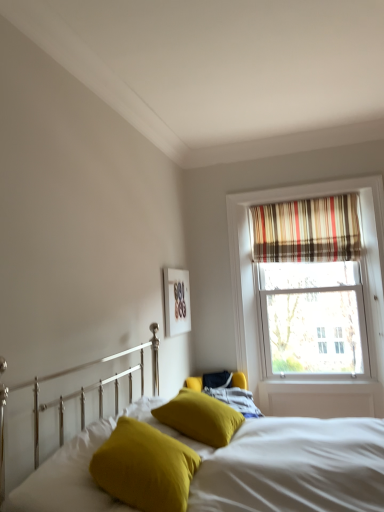
In order to click on velvety yellow pillow at lower left, which ranks as the 3th pillow in right-to-left order in this screenshot , I will do `click(68, 478)`.

What do you see at coordinates (286, 464) in the screenshot?
I see `velvet yellow pillows at center` at bounding box center [286, 464].

The image size is (384, 512). I want to click on velvet yellow pillows at center, so click(x=286, y=464).

What are the coordinates of `mustard yellow fabric pillow at lower center, which ranks as the second pillow in right-to-left order` in the screenshot? It's located at (145, 467).

How much space does mustard yellow fabric pillow at center, which is counted as the 1th pillow, starting from the right, occupy horizontally?

It is 19.24 inches.

Find the location of a particular element. This screenshot has height=512, width=384. striped fabric curtain at upper right is located at coordinates (307, 230).

Between velvety yellow pillow at lower left, which ranks as the 3th pillow in right-to-left order, and mustard yellow fabric pillow at lower center, which ranks as the second pillow in left-to-right order, which one appears on the left side from the viewer's perspective?

From the viewer's perspective, velvety yellow pillow at lower left, which ranks as the 3th pillow in right-to-left order, appears more on the left side.

Would you consider velvety yellow pillow at lower left, which is the 1th pillow from left to right, to be distant from mustard yellow fabric pillow at lower center, which ranks as the second pillow in right-to-left order?

They are positioned close to each other.

From a real-world perspective, which object rests below the other?

velvety yellow pillow at lower left, which is the 1th pillow from left to right, from a real-world perspective.

Considering the sizes of objects velvet yellow pillows at center and striped fabric curtain at upper right in the image provided, who is shorter, velvet yellow pillows at center or striped fabric curtain at upper right?

striped fabric curtain at upper right is shorter.

Is velvet yellow pillows at center not inside striped fabric curtain at upper right?

Yes, velvet yellow pillows at center is located beyond the bounds of striped fabric curtain at upper right.

From the image's perspective, which one is positioned lower, velvet yellow pillows at center or striped fabric curtain at upper right?

velvet yellow pillows at center.

Which is behind, matte white picture frame at upper center or striped fabric curtain at upper right?

Positioned behind is striped fabric curtain at upper right.

In the image, there is a matte white picture frame at upper center. At what (x,y) coordinates should I click in order to perform the action: click on curtain above it (from the image's perspective). Please return your answer as a coordinate pair (x, y). The width and height of the screenshot is (384, 512). Looking at the image, I should click on (307, 230).

Measure the distance from matte white picture frame at upper center to striped fabric curtain at upper right.

matte white picture frame at upper center is 4.15 feet away from striped fabric curtain at upper right.

What's the angular difference between matte white picture frame at upper center and striped fabric curtain at upper right's facing directions?

The angle between the facing direction of matte white picture frame at upper center and the facing direction of striped fabric curtain at upper right is 88.5 degrees.

Does mustard yellow fabric pillow at center, which is counted as the 1th pillow, starting from the right, have a lesser height compared to velvety yellow pillow at lower left, which is the 1th pillow from left to right?

In fact, mustard yellow fabric pillow at center, which is counted as the 1th pillow, starting from the right, may be taller than velvety yellow pillow at lower left, which is the 1th pillow from left to right.

Which is closer to the camera, (197, 406) or (36, 494)?

The point (36, 494) is closer to the camera.

You are a GUI agent. You are given a task and a screenshot of the screen. Output one action in this format:
    pyautogui.click(x=<x>, y=<y>)
    Task: Click on the pillow that is the 2nd object located in front of the mustard yellow fabric pillow at center, positioned as the 3th pillow in left-to-right order
    The height and width of the screenshot is (512, 384).
    Given the screenshot: What is the action you would take?
    pyautogui.click(x=68, y=478)

Is striped fabric curtain at upper right oriented away from velvet yellow pillows at center?

No, velvet yellow pillows at center is not at the back of striped fabric curtain at upper right.

Which is less distant, (x=262, y=211) or (x=347, y=421)?

Point (x=262, y=211) is farther from the camera than point (x=347, y=421).

Does striped fabric curtain at upper right contain velvet yellow pillows at center?

That's incorrect, velvet yellow pillows at center is not inside striped fabric curtain at upper right.

In terms of width, does striped fabric curtain at upper right look wider or thinner when compared to velvet yellow pillows at center?

In the image, striped fabric curtain at upper right appears to be more narrow than velvet yellow pillows at center.

Does point (186, 329) lie behind point (215, 426)?

Yes, it is.

Is matte white picture frame at upper center to the left or to the right of mustard yellow fabric pillow at center, which is counted as the 1th pillow, starting from the right, in the image?

matte white picture frame at upper center is to the left of mustard yellow fabric pillow at center, which is counted as the 1th pillow, starting from the right.

Locate an element on the screen. The image size is (384, 512). picture frame positioned vertically above the mustard yellow fabric pillow at center, positioned as the 3th pillow in left-to-right order (from a real-world perspective) is located at coordinates (176, 301).

Can you confirm if matte white picture frame at upper center is taller than mustard yellow fabric pillow at center, positioned as the 3th pillow in left-to-right order?

Correct, matte white picture frame at upper center is much taller as mustard yellow fabric pillow at center, positioned as the 3th pillow in left-to-right order.

Measure the distance from mustard yellow fabric pillow at lower center, which ranks as the second pillow in left-to-right order, to striped fabric curtain at upper right.

mustard yellow fabric pillow at lower center, which ranks as the second pillow in left-to-right order, is 2.84 meters away from striped fabric curtain at upper right.

Is mustard yellow fabric pillow at lower center, which ranks as the second pillow in left-to-right order, looking in the opposite direction of striped fabric curtain at upper right?

No, mustard yellow fabric pillow at lower center, which ranks as the second pillow in left-to-right order,'s orientation is not away from striped fabric curtain at upper right.

Which object is thinner, mustard yellow fabric pillow at lower center, which ranks as the second pillow in left-to-right order, or striped fabric curtain at upper right?

With smaller width is striped fabric curtain at upper right.

Image resolution: width=384 pixels, height=512 pixels. Find the location of `curtain that is above the mustard yellow fabric pillow at lower center, which ranks as the second pillow in left-to-right order (from the image's perspective)`. curtain that is above the mustard yellow fabric pillow at lower center, which ranks as the second pillow in left-to-right order (from the image's perspective) is located at coordinates (307, 230).

There is a velvety yellow pillow at lower left, which ranks as the 3th pillow in right-to-left order. Where is `the 2nd pillow above it (from the image's perspective)`? This screenshot has height=512, width=384. the 2nd pillow above it (from the image's perspective) is located at coordinates (145, 467).

The height and width of the screenshot is (512, 384). I want to click on bed below the striped fabric curtain at upper right (from a real-world perspective), so click(x=286, y=464).

Based on their spatial positions, is striped fabric curtain at upper right or velvet yellow pillows at center closer to mustard yellow fabric pillow at lower center, which ranks as the second pillow in right-to-left order?

The object closer to mustard yellow fabric pillow at lower center, which ranks as the second pillow in right-to-left order, is velvet yellow pillows at center.

From the image, which object appears to be farther from velvety yellow pillow at lower left, which ranks as the 3th pillow in right-to-left order, mustard yellow fabric pillow at center, positioned as the 3th pillow in left-to-right order, or striped fabric curtain at upper right?

striped fabric curtain at upper right.

Which object lies nearer to the anchor point striped fabric curtain at upper right, velvety yellow pillow at lower left, which ranks as the 3th pillow in right-to-left order, or mustard yellow fabric pillow at center, which is counted as the 1th pillow, starting from the right?

mustard yellow fabric pillow at center, which is counted as the 1th pillow, starting from the right.

Which object lies further to the anchor point velvety yellow pillow at lower left, which ranks as the 3th pillow in right-to-left order, striped fabric curtain at upper right or matte white picture frame at upper center?

Among the two, striped fabric curtain at upper right is located further to velvety yellow pillow at lower left, which ranks as the 3th pillow in right-to-left order.

Looking at the image, which one is located further to striped fabric curtain at upper right, matte white picture frame at upper center or mustard yellow fabric pillow at lower center, which ranks as the second pillow in right-to-left order?

mustard yellow fabric pillow at lower center, which ranks as the second pillow in right-to-left order, lies further to striped fabric curtain at upper right than the other object.

When comparing their distances from velvety yellow pillow at lower left, which is the 1th pillow from left to right, does mustard yellow fabric pillow at lower center, which ranks as the second pillow in right-to-left order, or striped fabric curtain at upper right seem further?

striped fabric curtain at upper right.

Looking at the image, which one is located further to mustard yellow fabric pillow at center, positioned as the 3th pillow in left-to-right order, striped fabric curtain at upper right or velvet yellow pillows at center?

Based on the image, striped fabric curtain at upper right appears to be further to mustard yellow fabric pillow at center, positioned as the 3th pillow in left-to-right order.

When comparing their distances from velvety yellow pillow at lower left, which is the 1th pillow from left to right, does mustard yellow fabric pillow at lower center, which ranks as the second pillow in right-to-left order, or matte white picture frame at upper center seem further?

matte white picture frame at upper center is further to velvety yellow pillow at lower left, which is the 1th pillow from left to right.

Where is `pillow positioned between mustard yellow fabric pillow at lower center, which ranks as the second pillow in right-to-left order, and striped fabric curtain at upper right from near to far`? This screenshot has height=512, width=384. pillow positioned between mustard yellow fabric pillow at lower center, which ranks as the second pillow in right-to-left order, and striped fabric curtain at upper right from near to far is located at coordinates (200, 417).

You are a GUI agent. You are given a task and a screenshot of the screen. Output one action in this format:
    pyautogui.click(x=<x>, y=<y>)
    Task: Click on the pillow between velvety yellow pillow at lower left, which is the 1th pillow from left to right, and mustard yellow fabric pillow at center, which is counted as the 1th pillow, starting from the right, along the z-axis
    Image resolution: width=384 pixels, height=512 pixels.
    Given the screenshot: What is the action you would take?
    (x=145, y=467)

This screenshot has height=512, width=384. Find the location of `picture frame positioned between velvety yellow pillow at lower left, which ranks as the 3th pillow in right-to-left order, and striped fabric curtain at upper right from near to far`. picture frame positioned between velvety yellow pillow at lower left, which ranks as the 3th pillow in right-to-left order, and striped fabric curtain at upper right from near to far is located at coordinates (176, 301).

The height and width of the screenshot is (512, 384). In order to click on picture frame positioned between mustard yellow fabric pillow at center, which is counted as the 1th pillow, starting from the right, and striped fabric curtain at upper right from near to far in this screenshot , I will do click(176, 301).